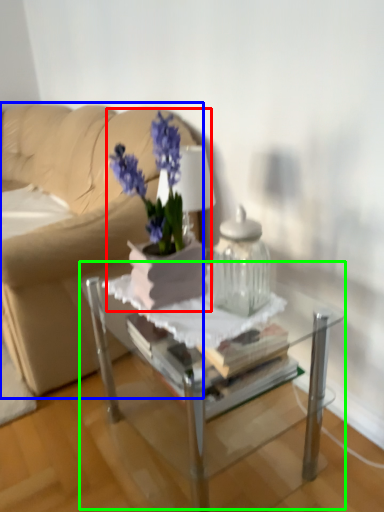
Question: Considering the real-world distances, which object is closest to houseplant (highlighted by a red box)? studio couch (highlighted by a blue box) or table (highlighted by a green box).

Choices:
 (A) studio couch
 (B) table

Answer: (B)